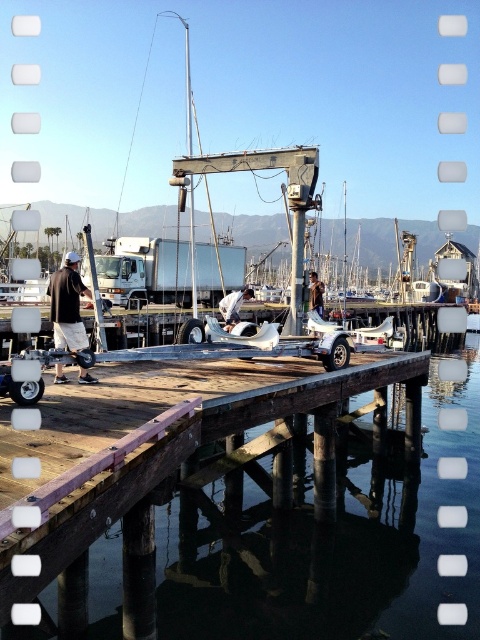
Can you confirm if dark gray shorts at center is positioned above white fabric sailboat at center?

No.

You are a GUI agent. You are given a task and a screenshot of the screen. Output one action in this format:
    pyautogui.click(x=<x>, y=<y>)
    Task: Click on the dark gray shorts at center
    Image resolution: width=480 pixels, height=640 pixels.
    Given the screenshot: What is the action you would take?
    pyautogui.click(x=68, y=305)

Does transparent water at center have a smaller size compared to brown leather jacket at center?

Actually, transparent water at center might be larger than brown leather jacket at center.

Looking at this image, does transparent water at center have a lesser height compared to brown leather jacket at center?

No, transparent water at center is not shorter than brown leather jacket at center.

Locate an element on the screen. This screenshot has width=480, height=640. transparent water at center is located at coordinates (235, 499).

The image size is (480, 640). I want to click on transparent water at center, so click(235, 499).

Who is more forward, (81, 285) or (313, 282)?

Point (81, 285) is more forward.

Who is positioned more to the right, dark gray shorts at center or brown leather jacket at center?

brown leather jacket at center

What are the coordinates of `dark gray shorts at center` in the screenshot? It's located at (68, 305).

Locate an element on the screen. This screenshot has height=640, width=480. dark gray shorts at center is located at coordinates (68, 305).